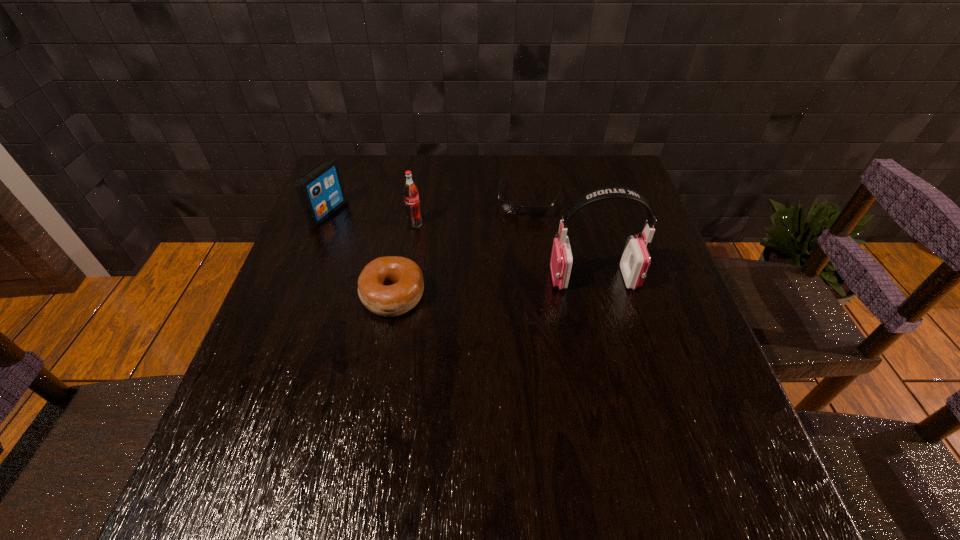
In the image, there is a desktop. At what (x,y) coordinates should I click in order to perform the action: click on vacant region at the far right corner. Please return your answer as a coordinate pair (x, y). Image resolution: width=960 pixels, height=540 pixels. Looking at the image, I should click on (577, 167).

Find the location of a particular element. vacant space at the near right corner of the desktop is located at coordinates (696, 406).

This screenshot has width=960, height=540. I want to click on blank region between the tallest object and the bagel, so click(493, 287).

You are a GUI agent. You are given a task and a screenshot of the screen. Output one action in this format:
    pyautogui.click(x=<x>, y=<y>)
    Task: Click on the vacant space in between the soda bottle and the third tallest object
    The height and width of the screenshot is (540, 960).
    Given the screenshot: What is the action you would take?
    pyautogui.click(x=372, y=219)

The width and height of the screenshot is (960, 540). Identify the location of free space between the second shortest object and the tallest object. (493, 287).

Locate an element on the screen. This screenshot has height=540, width=960. vacant space in between the third tallest object and the sunglasses is located at coordinates (428, 207).

At what (x,y) coordinates should I click in order to perform the action: click on free space between the bagel and the earphone. Please return your answer as a coordinate pair (x, y). The image size is (960, 540). Looking at the image, I should click on (493, 287).

You are a GUI agent. You are given a task and a screenshot of the screen. Output one action in this format:
    pyautogui.click(x=<x>, y=<y>)
    Task: Click on the free spot between the shortest object and the leftmost object
    
    Given the screenshot: What is the action you would take?
    pyautogui.click(x=428, y=207)

Identify the location of vacant area between the sunglasses and the bagel. This screenshot has width=960, height=540. [461, 248].

The height and width of the screenshot is (540, 960). What are the coordinates of `vacant area between the soda bottle and the leftmost object` in the screenshot? It's located at (372, 219).